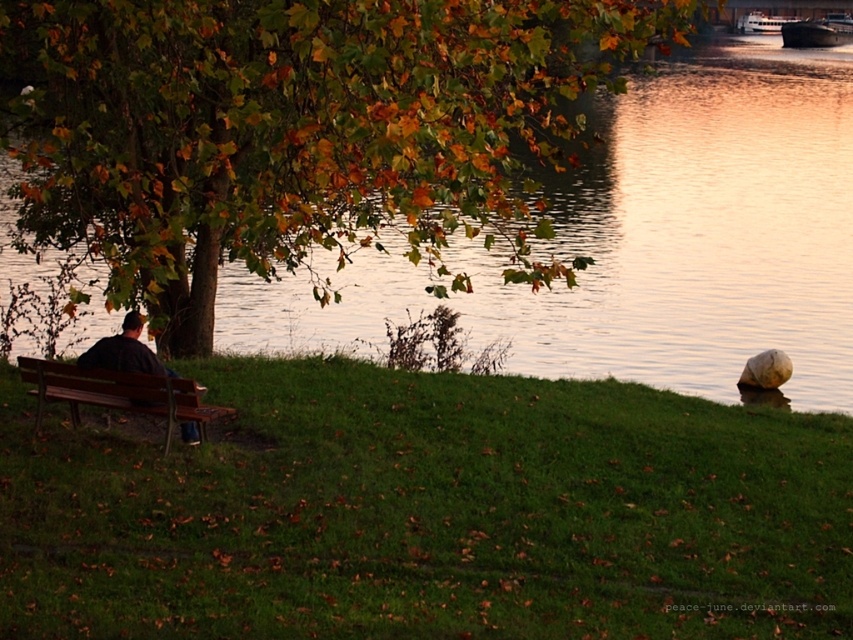
Question: Among these objects, which one is farthest from the camera?

Choices:
 (A) dark brown wooden boat at upper right
 (B) green leafy tree at upper left

Answer: (A)

Question: Which object is the closest to the dark brown wooden boat at upper right?

Choices:
 (A) dark brown wooden bench at left
 (B) green leafy tree at upper left

Answer: (B)

Question: Can you confirm if dark brown wooden boat at upper right is wider than white glossy boat at upper right?

Choices:
 (A) no
 (B) yes

Answer: (B)

Question: Which of the following is the farthest from the observer?

Choices:
 (A) (815, 28)
 (B) (762, 22)

Answer: (B)

Question: Can you confirm if dark brown wooden boat at upper right is positioned to the right of white glossy boat at upper right?

Choices:
 (A) yes
 (B) no

Answer: (A)

Question: Does green leafy tree at upper left appear on the right side of brown wooden bench at lower left?

Choices:
 (A) no
 (B) yes

Answer: (B)